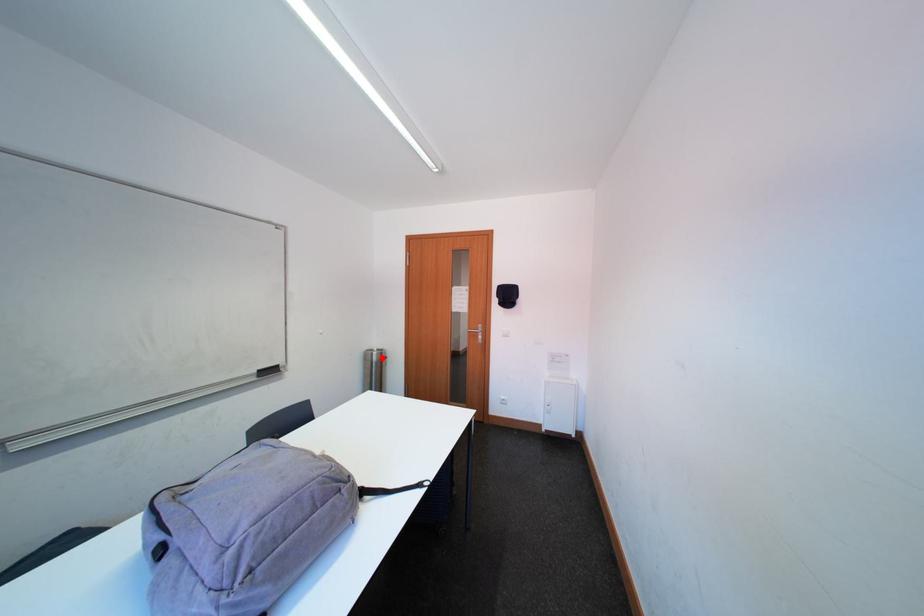
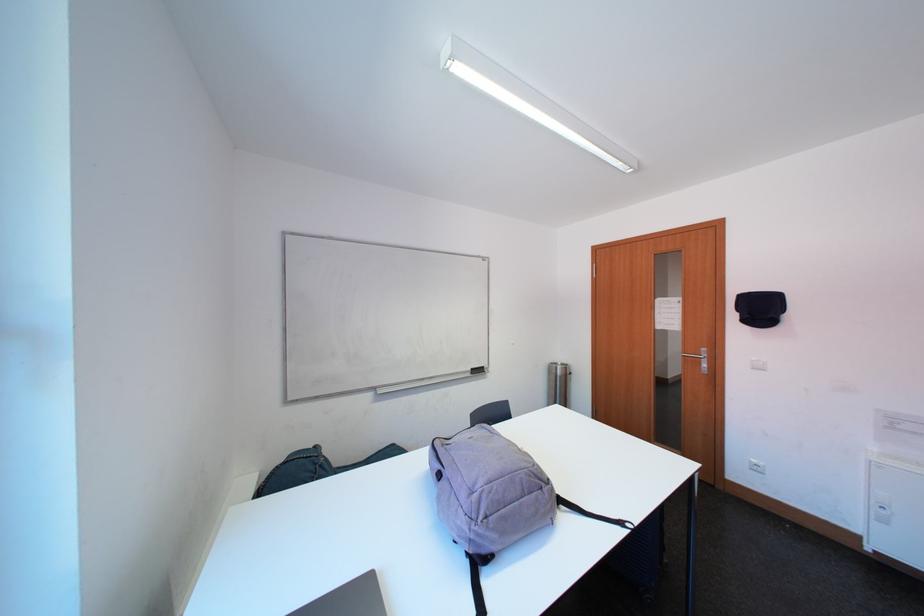
Find the pixel in the second image that matches the highlighted location in the first image.

(565, 371)